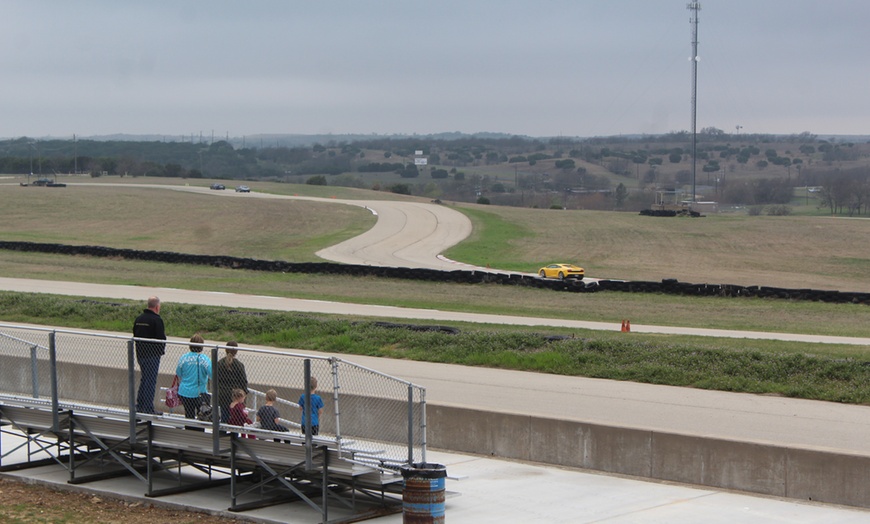
Where is `2 seating areas`? The height and width of the screenshot is (524, 870). 2 seating areas is located at coordinates (231, 453), (62, 408).